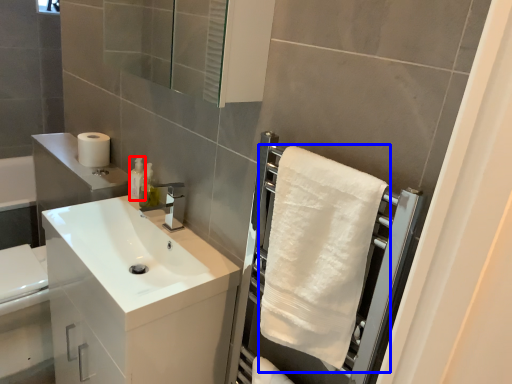
Question: Which point is further to the camera, toiletry (highlighted by a red box) or bath towel (highlighted by a blue box)?

Choices:
 (A) toiletry
 (B) bath towel

Answer: (A)